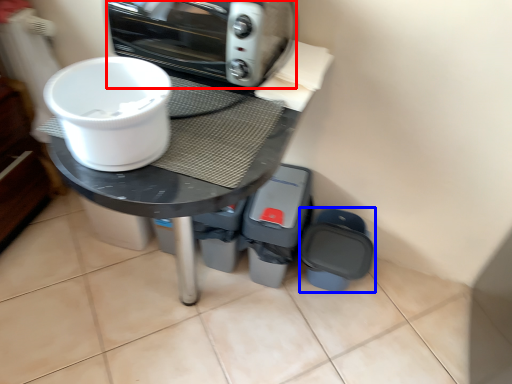
Question: Which point is further to the camera, kitchen appliance (highlighted by a red box) or appliance (highlighted by a blue box)?

Choices:
 (A) kitchen appliance
 (B) appliance

Answer: (B)